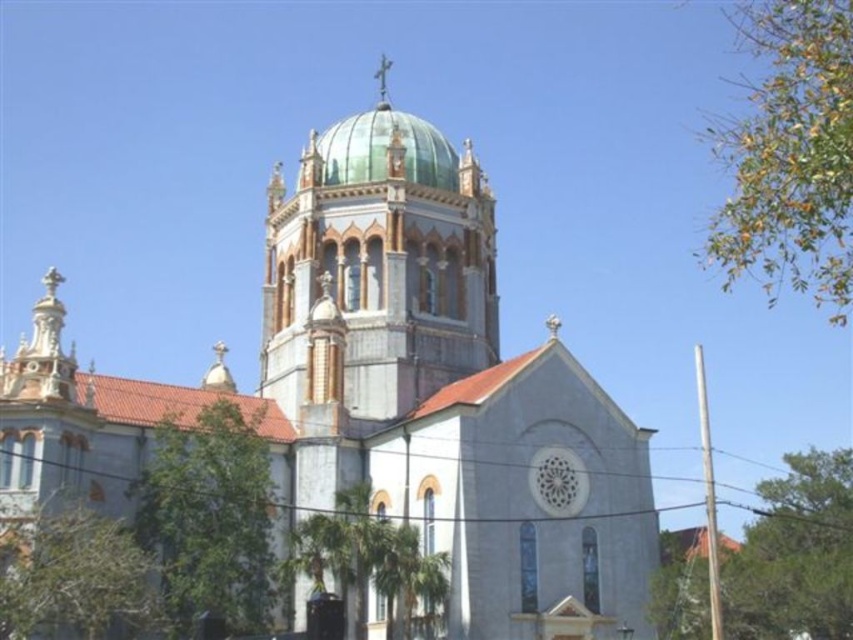
This screenshot has width=853, height=640. What do you see at coordinates (376, 268) in the screenshot?
I see `green glass dome at center` at bounding box center [376, 268].

Is green glass dome at center wider than green glass dome at upper center?

Indeed, green glass dome at center has a greater width compared to green glass dome at upper center.

What are the coordinates of `green glass dome at center` in the screenshot? It's located at (376, 268).

Does white stone church at center come behind green glass dome at center?

No, it is in front of green glass dome at center.

Can you confirm if white stone church at center is positioned above green glass dome at center?

Incorrect, white stone church at center is not positioned above green glass dome at center.

Is point (492, 220) in front of point (370, 205)?

That is False.

Find the location of `white stone church at center`. white stone church at center is located at coordinates (386, 406).

Between white stone church at center and green glass dome at upper center, which one has more height?

Standing taller between the two is white stone church at center.

Between point (546, 468) and point (440, 147), which one is positioned in front?

Positioned in front is point (546, 468).

This screenshot has width=853, height=640. Describe the element at coordinates (386, 406) in the screenshot. I see `white stone church at center` at that location.

You are a GUI agent. You are given a task and a screenshot of the screen. Output one action in this format:
    pyautogui.click(x=<x>, y=<y>)
    Task: Click on the white stone church at center
    The height and width of the screenshot is (640, 853).
    Given the screenshot: What is the action you would take?
    pyautogui.click(x=386, y=406)